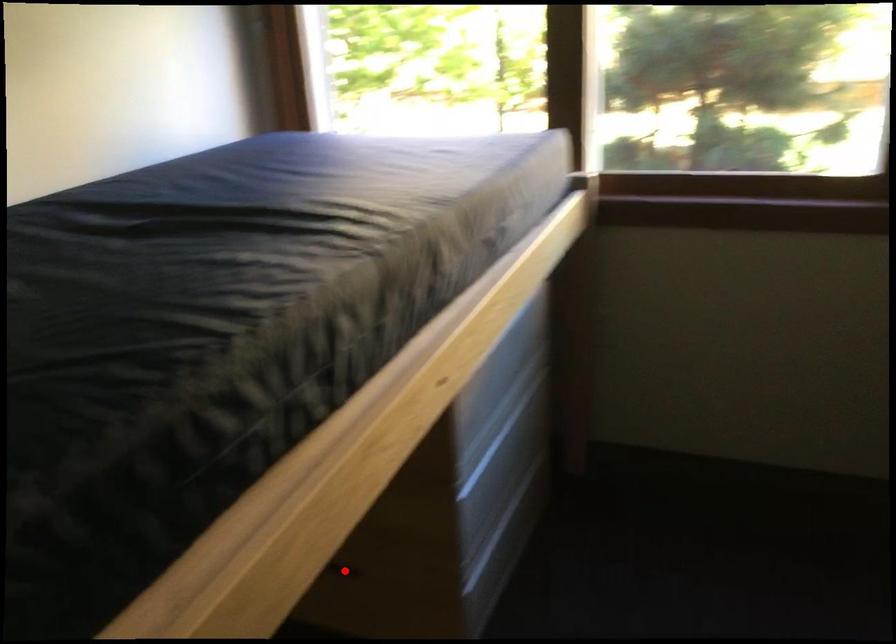
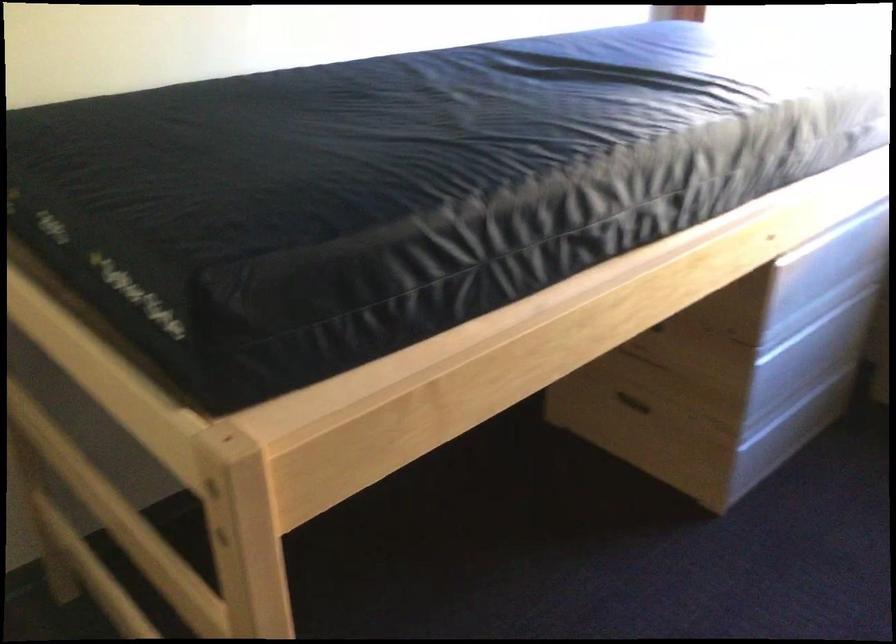
Where in the second image is the point corresponding to the highlighted location from the first image?

(633, 402)